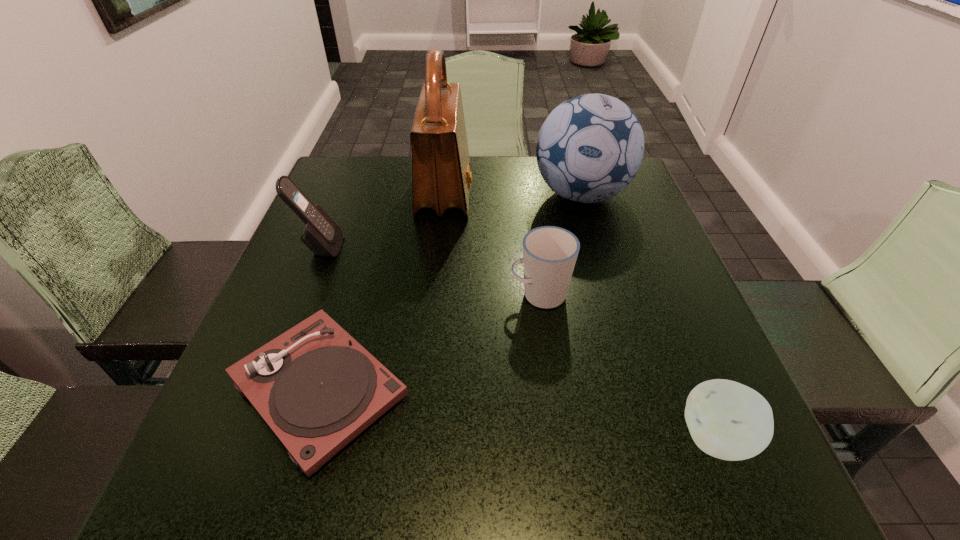
Image resolution: width=960 pixels, height=540 pixels. In order to click on empty space that is in between the fourth nearest object and the apple in this screenshot , I will do `click(518, 342)`.

Point out which object is positioned as the third nearest to the fourth tallest object. Please provide its 2D coordinates. Your answer should be formatted as a tuple, i.e. [(x, y)], where the tuple contains the x and y coordinates of a point satisfying the conditions above.

[(441, 178)]

The image size is (960, 540). Find the location of `object that is the second closest to the third tallest object`. object that is the second closest to the third tallest object is located at coordinates (317, 388).

Identify the location of vacant position in the image that satisfies the following two spatial constraints: 1. on the side with brand of the soccer ball; 2. with a handle on the side of the fourth tallest object. Image resolution: width=960 pixels, height=540 pixels. (610, 295).

You are a GUI agent. You are given a task and a screenshot of the screen. Output one action in this format:
    pyautogui.click(x=<x>, y=<y>)
    Task: Click on the vacant space that satisfies the following two spatial constraints: 1. with a handle on the side of the apple; 2. on the left side of the cup
    The height and width of the screenshot is (540, 960).
    Given the screenshot: What is the action you would take?
    pyautogui.click(x=559, y=438)

Locate an element on the screen. This screenshot has height=540, width=960. vacant space that satisfies the following two spatial constraints: 1. on the side with brand of the apple; 2. on the left side of the soccer ball is located at coordinates (652, 438).

Image resolution: width=960 pixels, height=540 pixels. Identify the location of blank space that satisfies the following two spatial constraints: 1. on the front-facing side of the second shortest object; 2. on the left side of the fourth shortest object. (244, 438).

Locate an element on the screen. The image size is (960, 540). vacant space that satisfies the following two spatial constraints: 1. on the side with brand of the second tallest object; 2. with a handle on the side of the fourth tallest object is located at coordinates (610, 295).

What are the coordinates of `free location that satisfies the following two spatial constraints: 1. on the front flap of the shoulder bag; 2. on the front side of the shortest object` in the screenshot? It's located at (425, 388).

Find the location of a particular element. This screenshot has height=540, width=960. vacant area that satisfies the following two spatial constraints: 1. on the front flap of the shoulder bag; 2. on the left side of the second shortest object is located at coordinates (420, 438).